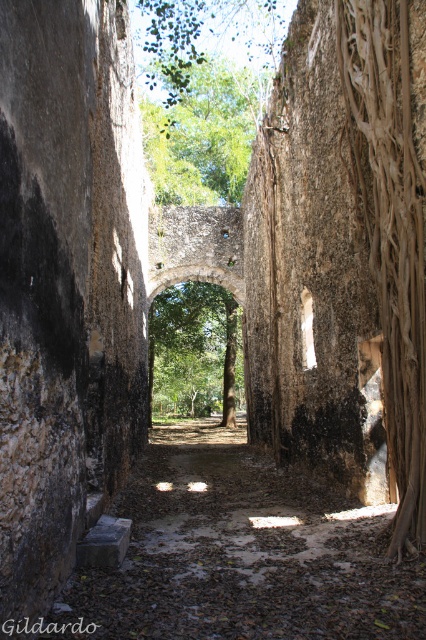
Who is more distant from viewer, (x=405, y=336) or (x=206, y=356)?

Positioned behind is point (x=206, y=356).

The height and width of the screenshot is (640, 426). I want to click on brown rough tree root at right, so click(x=389, y=230).

Locate an element on the screen. brown rough tree root at right is located at coordinates (389, 230).

Is brown rough tree root at right to the left of green leafy tree at upper center from the viewer's perspective?

In fact, brown rough tree root at right is to the right of green leafy tree at upper center.

Which is in front, point (414, 522) or point (149, 102)?

Positioned in front is point (414, 522).

Is point (383, 198) farther from camera compared to point (216, 161)?

No, (383, 198) is closer to viewer.

The width and height of the screenshot is (426, 640). In order to click on brown rough tree root at right in this screenshot , I will do `click(389, 230)`.

Between green leafy tree at upper center and green leafy archway at center, which one has less height?

Standing shorter between the two is green leafy archway at center.

Describe the element at coordinates (204, 134) in the screenshot. This screenshot has width=426, height=640. I see `green leafy tree at upper center` at that location.

You are a GUI agent. You are given a task and a screenshot of the screen. Output one action in this format:
    pyautogui.click(x=<x>, y=<y>)
    Task: Click on the green leafy tree at upper center
    
    Given the screenshot: What is the action you would take?
    (x=204, y=134)